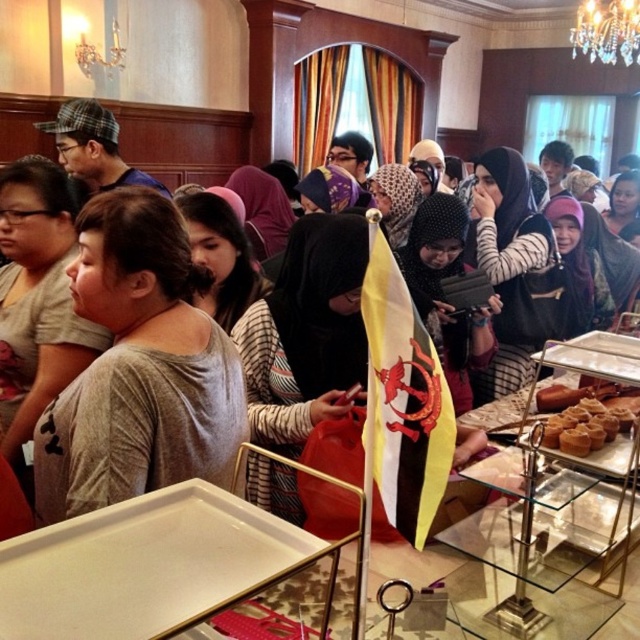
Can you confirm if matte black shirt at center is smaller than golden brown pastry at lower right?

No, matte black shirt at center is not smaller than golden brown pastry at lower right.

Identify the location of matte black shirt at center. (182, 140).

Measure the distance between point (108,396) and camera.

The distance of point (108,396) from camera is 1.25 meters.

Which of these two, gray matte shirt at center or golden brown pastry at lower right, stands shorter?

Standing shorter between the two is golden brown pastry at lower right.

Which is behind, point (228, 387) or point (595, 426)?

Point (228, 387)

Where is `gray matte shirt at center`? This screenshot has height=640, width=640. gray matte shirt at center is located at coordinates (138, 369).

Is gray matte shirt at center positioned behind matte black shirt at center?

No.

Which is behind, point (60, 422) or point (52, 115)?

Positioned behind is point (52, 115).

The height and width of the screenshot is (640, 640). I want to click on gray matte shirt at center, so click(138, 369).